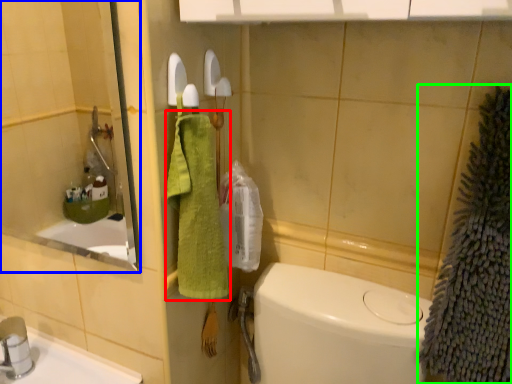
Question: Considering the real-world distances, which object is farthest from bath towel (highlighted by a red box)? mirror (highlighted by a blue box) or bath towel (highlighted by a green box)?

Choices:
 (A) mirror
 (B) bath towel

Answer: (A)